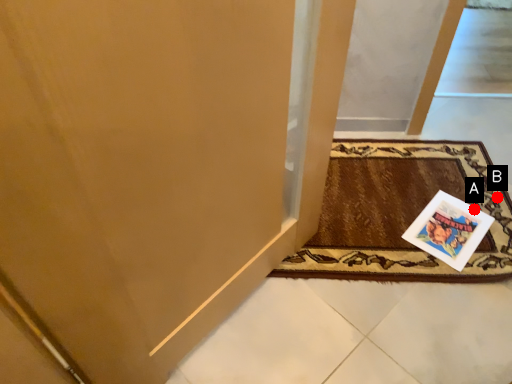
Question: Two points are circled on the image, labeled by A and B beside each circle. Which point is further to the camera?

Choices:
 (A) A is further
 (B) B is further

Answer: (B)